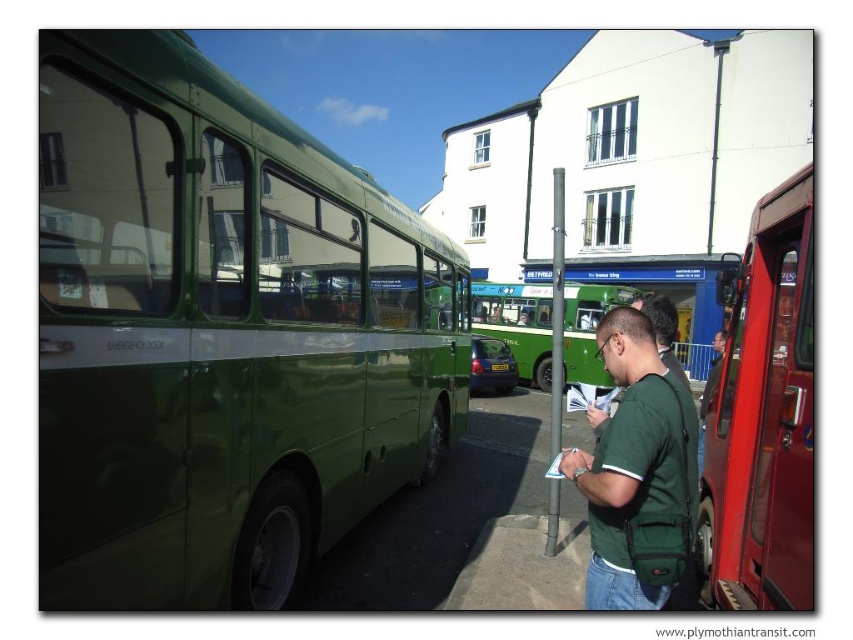
Question: Is green matte bus at left to the left of green matte shirt at center from the viewer's perspective?

Choices:
 (A) no
 (B) yes

Answer: (B)

Question: Which object is the closest to the green plastic bus stop at center?

Choices:
 (A) metallic red bus at right
 (B) green matte bus at center

Answer: (B)

Question: Which of these objects is positioned farthest from the green matte bus at center?

Choices:
 (A) metallic red bus at right
 (B) green matte bus at left

Answer: (A)

Question: Can you confirm if metallic red bus at right is bigger than green matte shirt at center?

Choices:
 (A) no
 (B) yes

Answer: (A)

Question: Can you confirm if metallic red bus at right is wider than green matte shirt at center?

Choices:
 (A) yes
 (B) no

Answer: (B)

Question: Among these points, which one is farthest from the camera?

Choices:
 (A) (625, 289)
 (B) (297, 484)

Answer: (A)